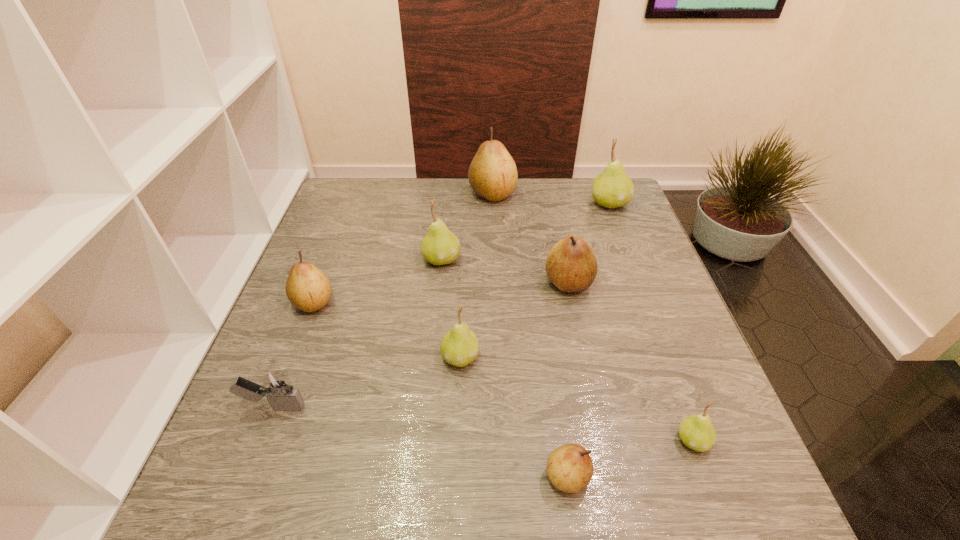
This screenshot has height=540, width=960. Find the location of `vacant space located on the back of the smallest green pear`. vacant space located on the back of the smallest green pear is located at coordinates (669, 377).

Locate an element on the screen. Image resolution: width=960 pixels, height=540 pixels. object that is positioned at the near edge is located at coordinates (570, 468).

This screenshot has width=960, height=540. I want to click on pear at the left edge, so click(x=308, y=288).

Locate an element on the screen. igniter located at the left edge is located at coordinates (276, 386).

Identify the location of object that is at the far right corner. (613, 188).

Identify the location of vacant space at the far edge of the desktop. (404, 205).

Find the location of a particular element. free space at the right edge is located at coordinates (705, 404).

The width and height of the screenshot is (960, 540). What are the coordinates of `vacant space at the far left corner of the desktop` in the screenshot? It's located at (358, 184).

The height and width of the screenshot is (540, 960). What are the coordinates of `vacant region at the near left corner of the desktop` in the screenshot? It's located at (221, 485).

Where is `unoccupied position between the third nearest pear and the gray igniter`? unoccupied position between the third nearest pear and the gray igniter is located at coordinates (367, 382).